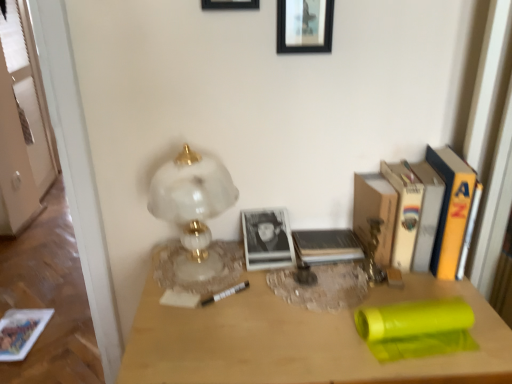
Where is `vacant area in front of white paper at right, which appears as the 2th paperback book when viewed from the right`? Image resolution: width=512 pixels, height=384 pixels. vacant area in front of white paper at right, which appears as the 2th paperback book when viewed from the right is located at coordinates (431, 289).